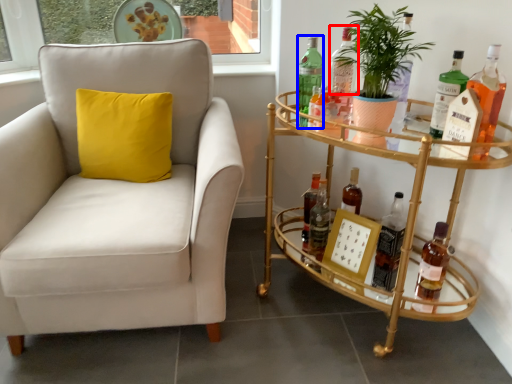
Question: Which point is closer to the camera, bottle (highlighted by a red box) or bottle (highlighted by a blue box)?

Choices:
 (A) bottle
 (B) bottle

Answer: (A)